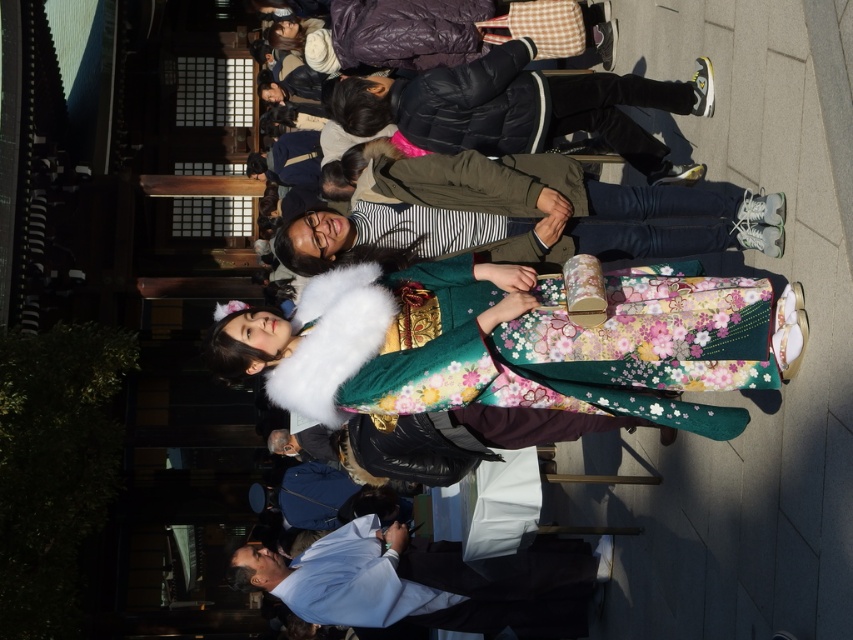
Question: Does floral silk kimono at center appear under striped fabric shirt at center?

Choices:
 (A) yes
 (B) no

Answer: (A)

Question: Which object appears farthest from the camera in this image?

Choices:
 (A) floral silk kimono at center
 (B) striped fabric shirt at center
 (C) fluffy white kimono at center

Answer: (C)

Question: Which object is closer to the camera taking this photo?

Choices:
 (A) fluffy white kimono at center
 (B) floral silk kimono at center

Answer: (B)

Question: Which point is farther from the camera taking this photo?

Choices:
 (A) (347, 250)
 (B) (283, 388)

Answer: (A)

Question: Can you confirm if floral silk kimono at center is positioned to the right of striped fabric shirt at center?

Choices:
 (A) no
 (B) yes

Answer: (A)

Question: Can you confirm if fluffy white kimono at center is thinner than striped fabric shirt at center?

Choices:
 (A) no
 (B) yes

Answer: (B)